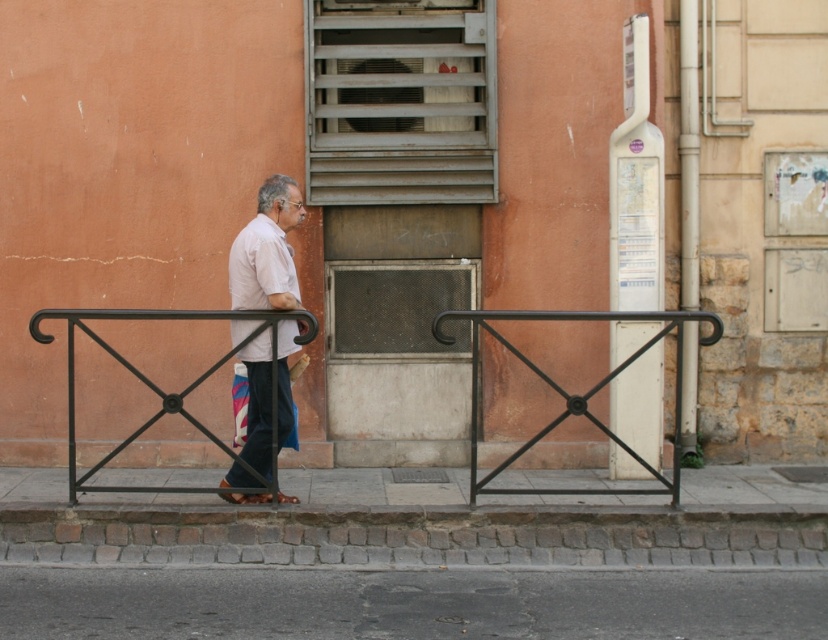
You are a delivery person who needs to place a small package on the ground. The gray asphalt at lower center and the black metal balustrade at center are both visible. Which surface can you use to place the package?

The gray asphalt at lower center is smaller than the black metal balustrade at center. Therefore, the black metal balustrade at center is a larger surface and can accommodate the package more securely.

You are a delivery person trying to cross the street. You see the gray asphalt at lower center and the black metal balustrade at center. Which direction should you move to reach the asphalt from the balustrade?

To reach the gray asphalt at lower center from the black metal balustrade at center, you should move to the right since the gray asphalt is positioned to the right of the balustrade.

You are a delivery robot with a 1.2 meter wide package. You need to navigate through the space between the gray asphalt at lower center and the black metal rail at center. Can your package fit through this space?

The space between the gray asphalt at lower center and the black metal rail at center is 1.24 meters, so the 1.2 meter wide package can fit through this space since it is slightly narrower than the available space.